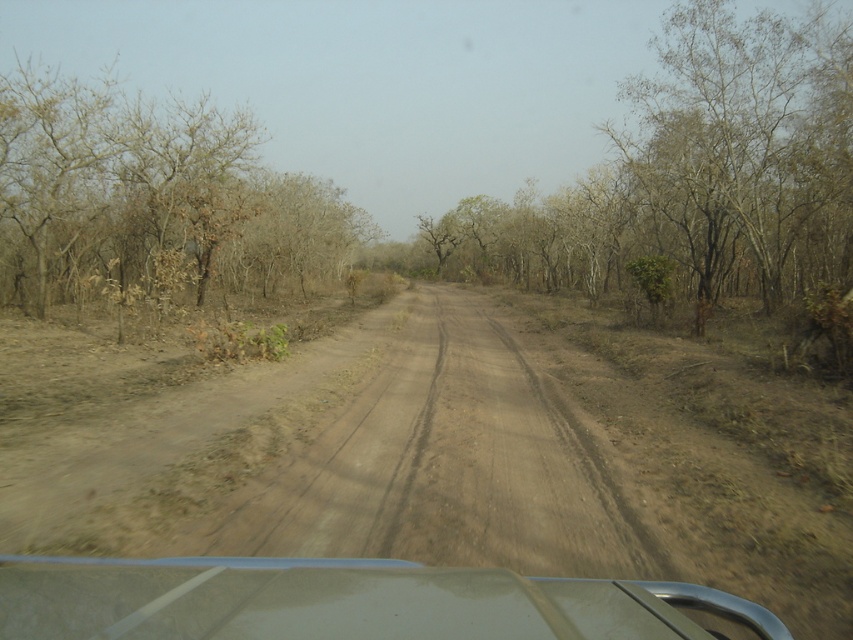
You are sitting in the vehicle and looking out the window. You see two points marked on the road ahead. Which point is closer to you, the point at coordinates (445, 221) or the point at (363, 512)?

The point at coordinates (445, 221) is closer to you because it is further to the viewer than the point at (363, 512).

You are sitting in the vehicle and looking out the window. You see two points marked on the road ahead. The first point is at coordinate point (633,515) and the second is at coordinate point (68,253). Which point is closer to you as you drive forward?

Point (633,515) is closer to the viewer than point (68,253), so the first point is closer to you as you drive forward.

Based on the photo, you are driving a car and see the bare branches at center and the brown dry tree at left through the windshield. Which object is closer to the left side of the road?

The brown dry tree at left is closer to the left side of the road because it is positioned to the left of the bare branches at center.